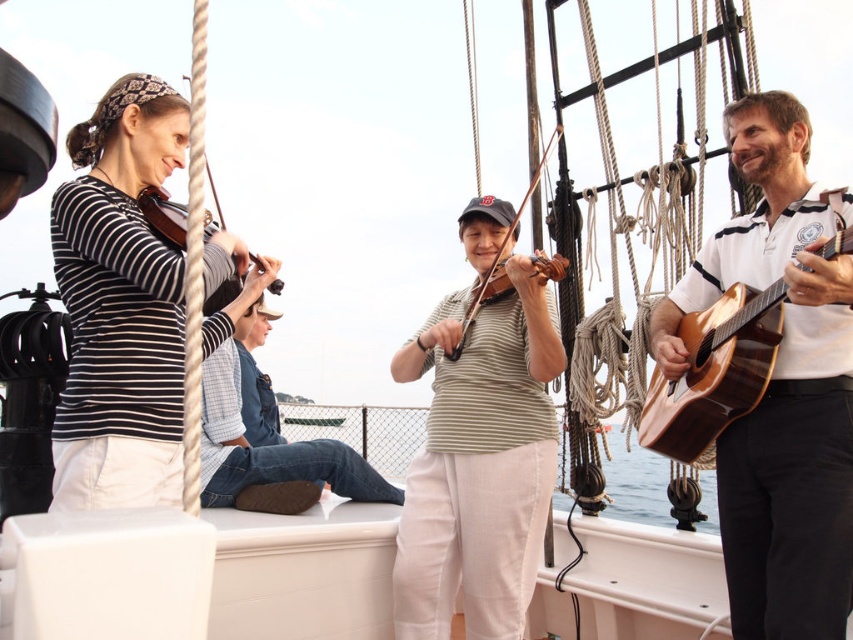
Image resolution: width=853 pixels, height=640 pixels. What are the coordinates of `wooden acoustic guitar at right` in the screenshot? It's located at (780, 387).

Between wooden acoustic guitar at right and wooden violin at left, which one has more height?

Standing taller between the two is wooden acoustic guitar at right.

What do you see at coordinates (780, 387) in the screenshot? I see `wooden acoustic guitar at right` at bounding box center [780, 387].

The image size is (853, 640). Identify the location of wooden acoustic guitar at right. (780, 387).

From the picture: Can you confirm if denim jeans at center is bigger than wooden violin at left?

Yes.

Locate an element on the screen. denim jeans at center is located at coordinates pos(268,444).

The width and height of the screenshot is (853, 640). I want to click on denim jeans at center, so click(268, 444).

You are a GUI agent. You are given a task and a screenshot of the screen. Output one action in this format:
    pyautogui.click(x=<x>, y=<y>)
    Task: Click on the denim jeans at center
    The height and width of the screenshot is (640, 853).
    Given the screenshot: What is the action you would take?
    pyautogui.click(x=268, y=444)

Looking at this image, does matte black violin at left have a lesser width compared to green striped shirt at center?

Incorrect, matte black violin at left's width is not less than green striped shirt at center's.

Who is positioned more to the left, matte black violin at left or green striped shirt at center?

matte black violin at left is more to the left.

Locate an element on the screen. The image size is (853, 640). matte black violin at left is located at coordinates (120, 307).